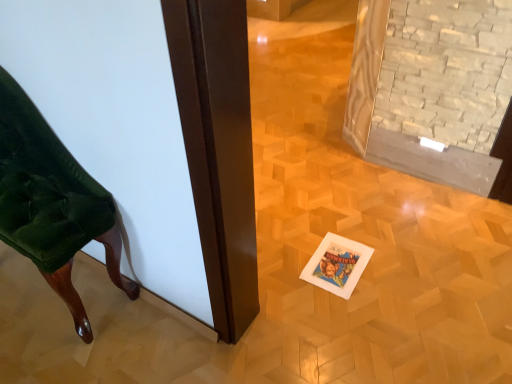
Where is `free location in front of white paper postcard at center`? free location in front of white paper postcard at center is located at coordinates (347, 311).